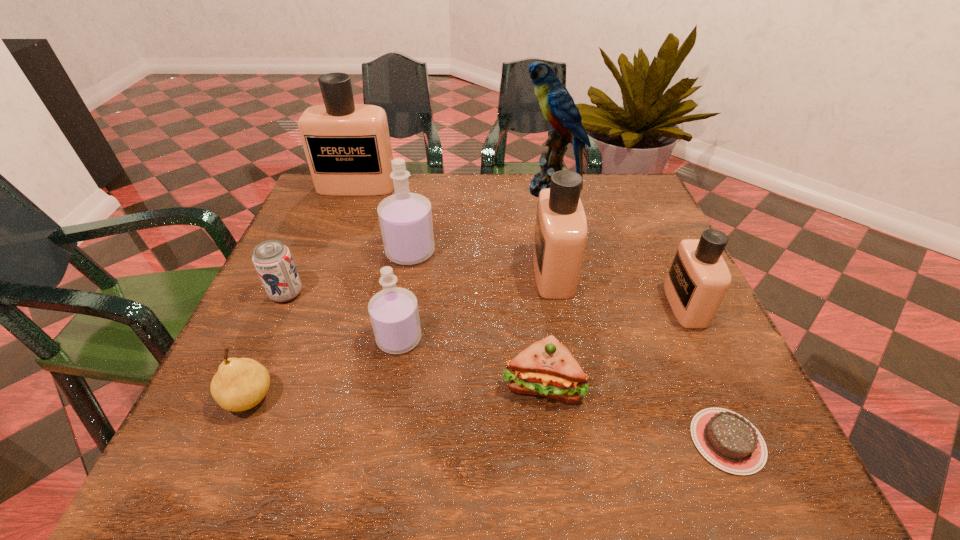
Where is `parrot that is at the far edge`? Image resolution: width=960 pixels, height=540 pixels. parrot that is at the far edge is located at coordinates (558, 107).

Identify the location of perfume located in the far edge section of the desktop. The image size is (960, 540). (347, 146).

I want to click on pear positioned at the near edge, so click(240, 384).

I want to click on chocolate cake at the near edge, so click(726, 439).

This screenshot has height=540, width=960. What are the coordinates of `perfume that is at the left edge` in the screenshot? It's located at (347, 146).

This screenshot has height=540, width=960. I want to click on beer can present at the left edge, so click(274, 264).

This screenshot has height=540, width=960. What are the coordinates of `pear that is at the left edge` in the screenshot? It's located at 240,384.

Identify the location of perfume that is at the right edge. (698, 279).

This screenshot has width=960, height=540. Identify the location of chocolate cake that is at the right edge. (726, 439).

Where is `object that is positioned at the far left corner`? This screenshot has height=540, width=960. object that is positioned at the far left corner is located at coordinates [x=347, y=146].